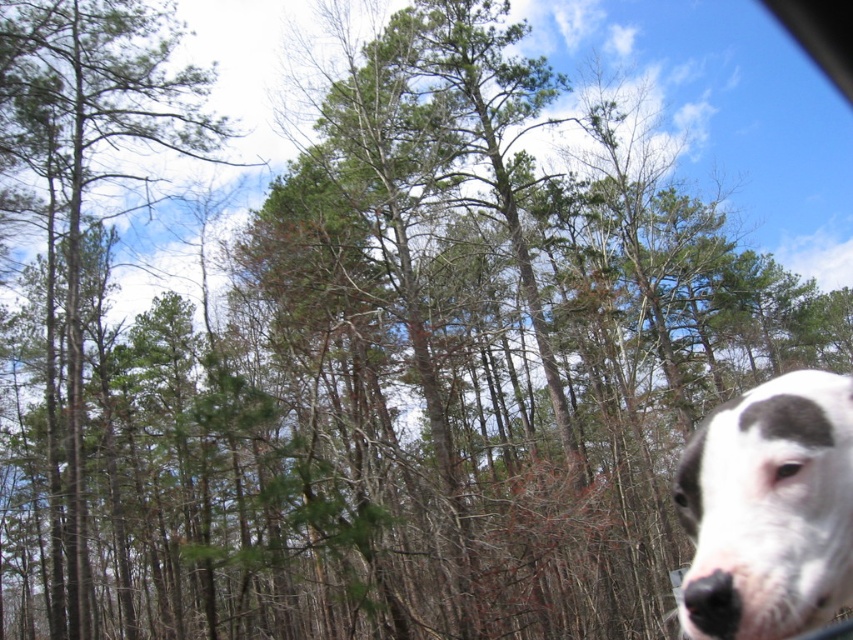
Question: Is white fur dog at lower right in front of green leafy tree at upper left?

Choices:
 (A) no
 (B) yes

Answer: (B)

Question: Which point appears closest to the camera in this image?

Choices:
 (A) (701, 522)
 (B) (167, 131)

Answer: (A)

Question: Is white fur dog at lower right above green leafy tree at upper left?

Choices:
 (A) yes
 (B) no

Answer: (B)

Question: Is white fur dog at lower right positioned in front of green leafy tree at upper left?

Choices:
 (A) no
 (B) yes

Answer: (B)